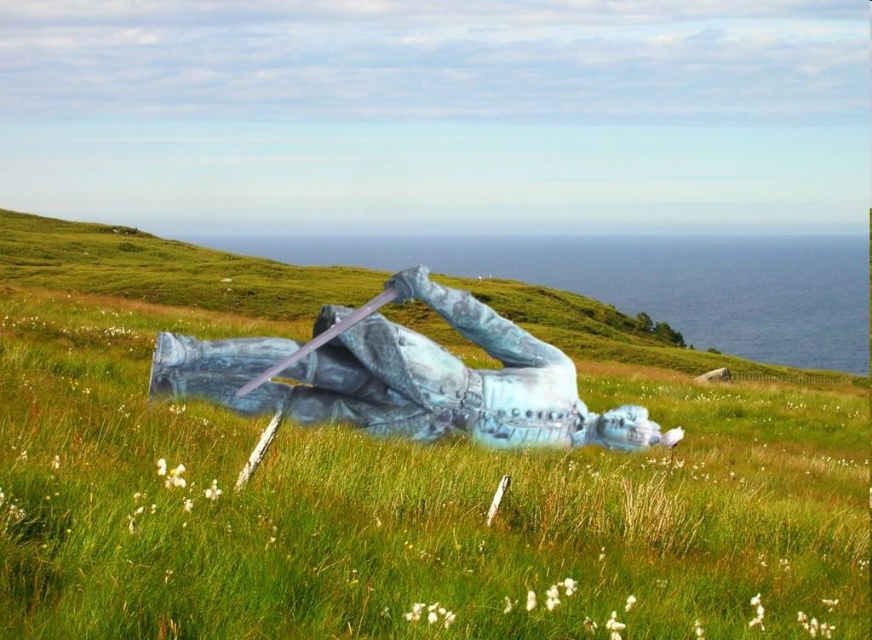
Is point (610, 586) positioned after point (65, 244)?

No, it is not.

Where is `blue metallic statue at center`? Image resolution: width=872 pixels, height=640 pixels. blue metallic statue at center is located at coordinates (405, 509).

Who is lower down, blue-green metallic statue at center or blue-green stone statue at center?

Positioned lower is blue-green metallic statue at center.

Is point (659, 436) in front of point (512, 282)?

Yes, it is in front of point (512, 282).

What are the coordinates of `blue-green metallic statue at center` in the screenshot? It's located at (409, 380).

Can you confirm if blue metallic statue at center is shorter than blue-green metallic statue at center?

In fact, blue metallic statue at center may be taller than blue-green metallic statue at center.

Can you confirm if blue metallic statue at center is wider than blue-green metallic statue at center?

Yes.

This screenshot has height=640, width=872. What do you see at coordinates (405, 509) in the screenshot?
I see `blue metallic statue at center` at bounding box center [405, 509].

Locate an element on the screen. blue metallic statue at center is located at coordinates (405, 509).